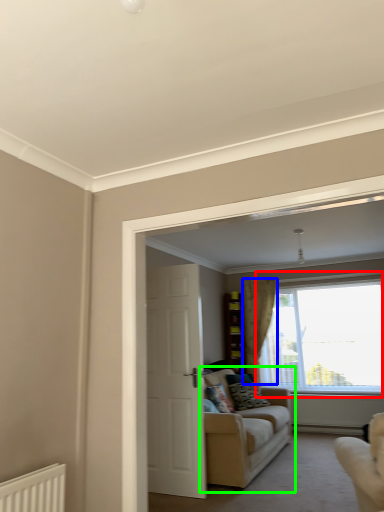
Question: Which object is the farthest from window (highlighted by a red box)? Choose among these: curtain (highlighted by a blue box) or studio couch (highlighted by a green box).

Choices:
 (A) curtain
 (B) studio couch

Answer: (B)